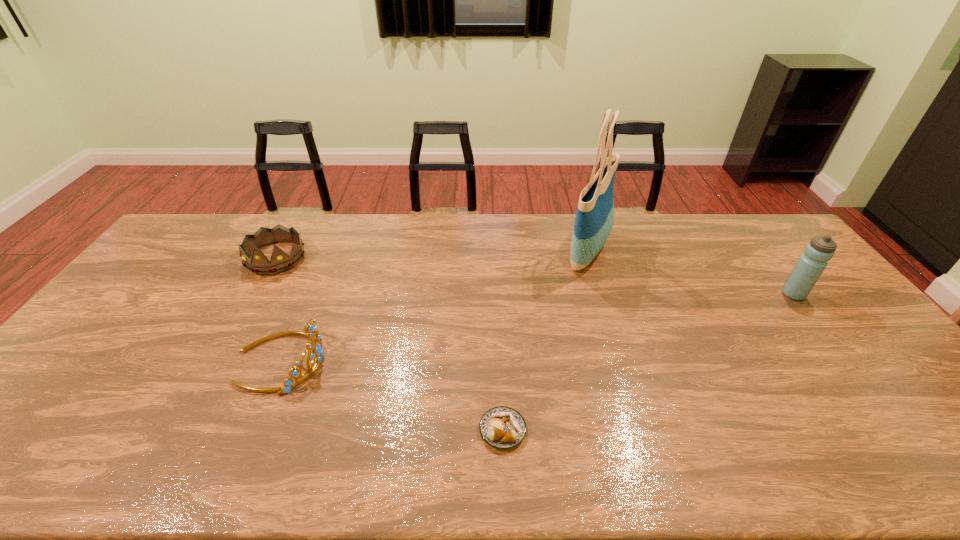
Find the location of a particular element. vacant space at the right edge of the desktop is located at coordinates (866, 353).

Locate an element on the screen. empty space between the farther tiara and the nearer tiara is located at coordinates (278, 309).

This screenshot has height=540, width=960. Find the location of `free spot between the third nearest object and the tallest object`. free spot between the third nearest object and the tallest object is located at coordinates (690, 272).

The image size is (960, 540). I want to click on free space between the tallest object and the nearer tiara, so click(x=434, y=305).

Where is `free point between the shortest object and the rightmost object`? The width and height of the screenshot is (960, 540). free point between the shortest object and the rightmost object is located at coordinates click(x=648, y=362).

You are a GUI agent. You are given a task and a screenshot of the screen. Output one action in this format:
    pyautogui.click(x=<x>, y=<y>)
    Task: Click on the free spot between the farther tiara and the third object from left to right
    
    Given the screenshot: What is the action you would take?
    (389, 344)

Identify the location of free space between the fourth object from left to right and the pastry. The image size is (960, 540). (545, 340).

Where is `free spot between the farther tiara and the fourth farthest object`? The width and height of the screenshot is (960, 540). free spot between the farther tiara and the fourth farthest object is located at coordinates (278, 309).

Image resolution: width=960 pixels, height=540 pixels. Find the location of `free space between the water bottle and the fourth farthest object`. free space between the water bottle and the fourth farthest object is located at coordinates (538, 327).

The image size is (960, 540). In order to click on free spot between the fourth shortest object and the farther tiara in this screenshot , I will do `click(535, 276)`.